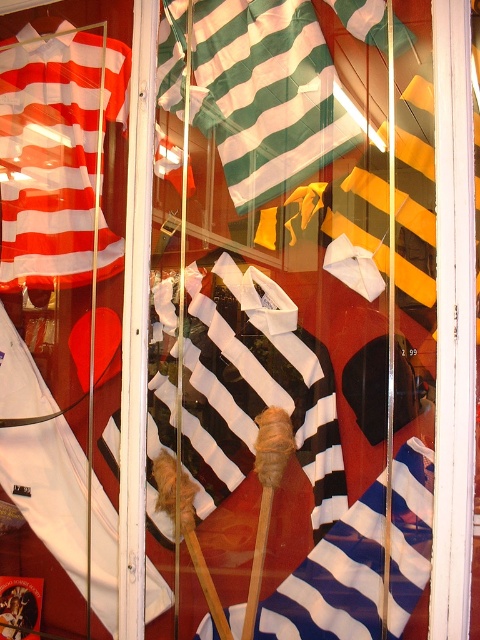
Question: Which object is farther from the camera taking this photo?

Choices:
 (A) green striped fabric at center
 (B) blue striped fabric at center
 (C) red striped fabric at left

Answer: (C)

Question: Does green striped fabric at center appear over red striped fabric at left?

Choices:
 (A) yes
 (B) no

Answer: (A)

Question: In this image, where is red striped fabric at left located relative to blue striped fabric at center?

Choices:
 (A) left
 (B) right

Answer: (A)

Question: Which object is positioned closest to the red striped fabric at left?

Choices:
 (A) blue striped fabric at center
 (B) green striped fabric at center

Answer: (B)

Question: Which point is closer to the camera?

Choices:
 (A) (269, 115)
 (B) (119, 86)

Answer: (A)

Question: Does red striped fabric at left appear on the left side of blue striped fabric at center?

Choices:
 (A) no
 (B) yes

Answer: (B)